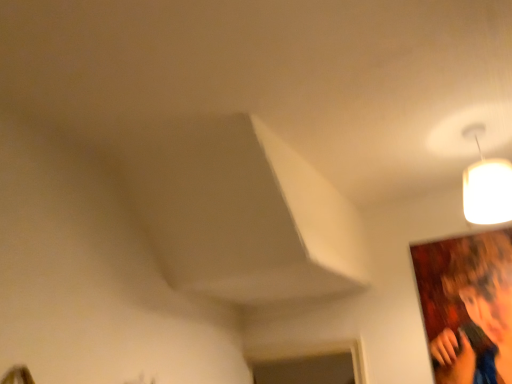
Question: From a real-world perspective, is white matte lampshade at upper right over smooth brown hair at upper right?

Choices:
 (A) yes
 (B) no

Answer: (A)

Question: Is white matte lampshade at upper right far away from smooth brown hair at upper right?

Choices:
 (A) yes
 (B) no

Answer: (B)

Question: Does white matte lampshade at upper right have a greater width compared to smooth brown hair at upper right?

Choices:
 (A) no
 (B) yes

Answer: (B)

Question: Are white matte lampshade at upper right and smooth brown hair at upper right making contact?

Choices:
 (A) yes
 (B) no

Answer: (B)

Question: Could you tell me if white matte lampshade at upper right is facing smooth brown hair at upper right?

Choices:
 (A) no
 (B) yes

Answer: (A)

Question: Is white matte lampshade at upper right further to the viewer compared to smooth brown hair at upper right?

Choices:
 (A) no
 (B) yes

Answer: (A)

Question: Is smooth brown hair at upper right facing away from white matte lampshade at upper right?

Choices:
 (A) no
 (B) yes

Answer: (A)

Question: Can you confirm if smooth brown hair at upper right is positioned to the left of white matte lampshade at upper right?

Choices:
 (A) no
 (B) yes

Answer: (A)

Question: Is smooth brown hair at upper right shorter than white matte lampshade at upper right?

Choices:
 (A) yes
 (B) no

Answer: (B)

Question: From a real-world perspective, is smooth brown hair at upper right positioned under white matte lampshade at upper right based on gravity?

Choices:
 (A) no
 (B) yes

Answer: (B)

Question: Is smooth brown hair at upper right behind white matte lampshade at upper right?

Choices:
 (A) no
 (B) yes

Answer: (B)

Question: Is smooth brown hair at upper right facing towards white matte lampshade at upper right?

Choices:
 (A) yes
 (B) no

Answer: (A)

Question: Is point (480, 190) closer or farther from the camera than point (506, 326)?

Choices:
 (A) farther
 (B) closer

Answer: (B)